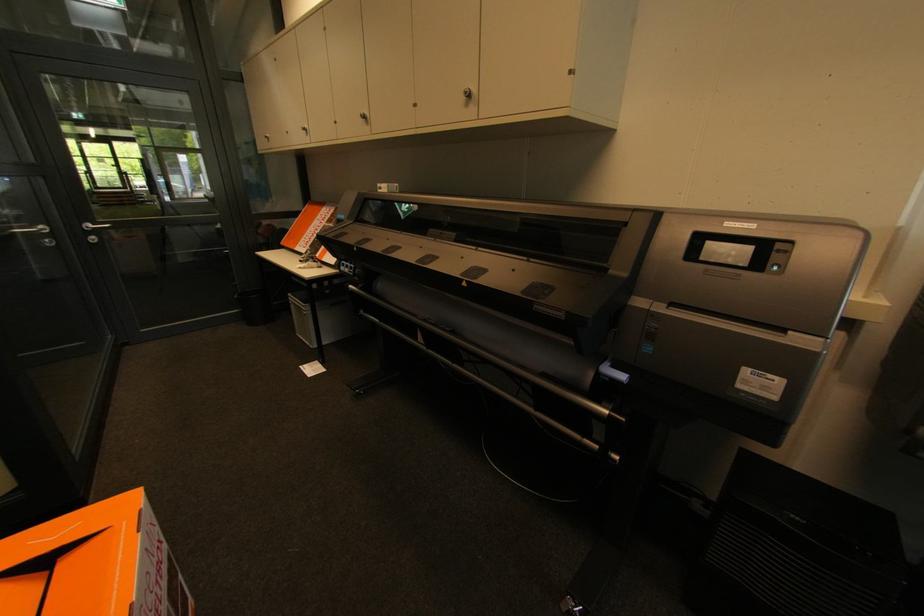
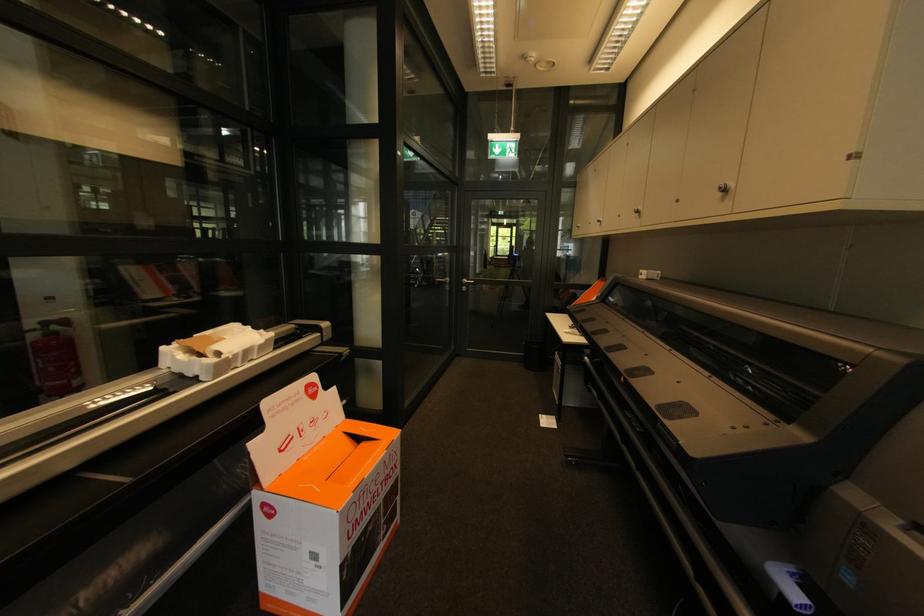
Find the pixel in the second image that matches point (472, 95) in the first image.

(727, 191)